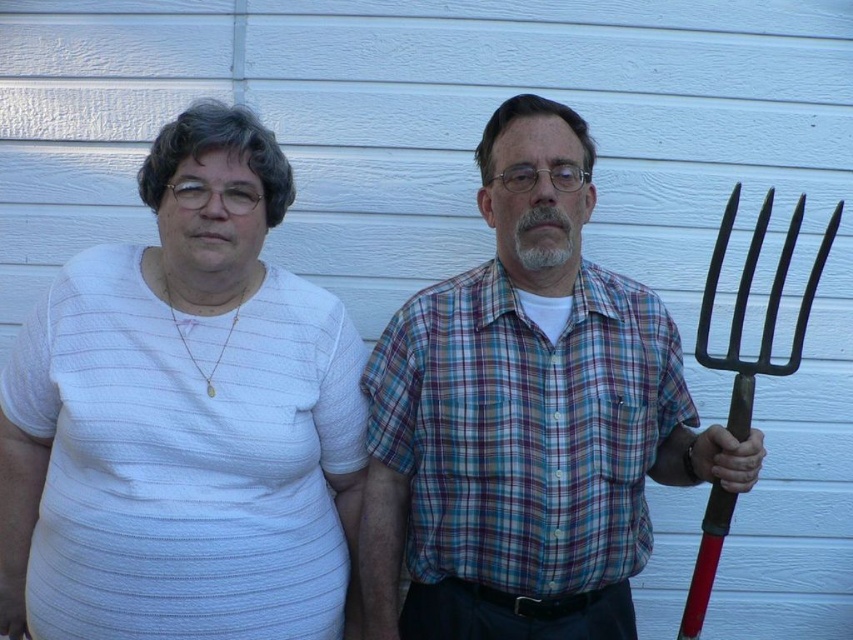
You are standing in front of the two people in the image. Which of the two points, point (497, 285) or point (743, 440), is closer to you?

Point (743, 440) is closer to you because it is in front of point (497, 285).

You are a photographer setting up for a portrait. You need to position a light source to the right of both the white striped shirt at left and the matte plaid shirt at center. Is this possible given their current positions?

The white striped shirt at left is to the left of the matte plaid shirt at center. Since the matte plaid shirt at center is already to the right of the white striped shirt at left, placing the light source to the right of both would require it to be positioned beyond the matte plaid shirt at center, which is feasible as there is space to the right edge of the frame as indicated by the pitchfork extending towards the right edge.